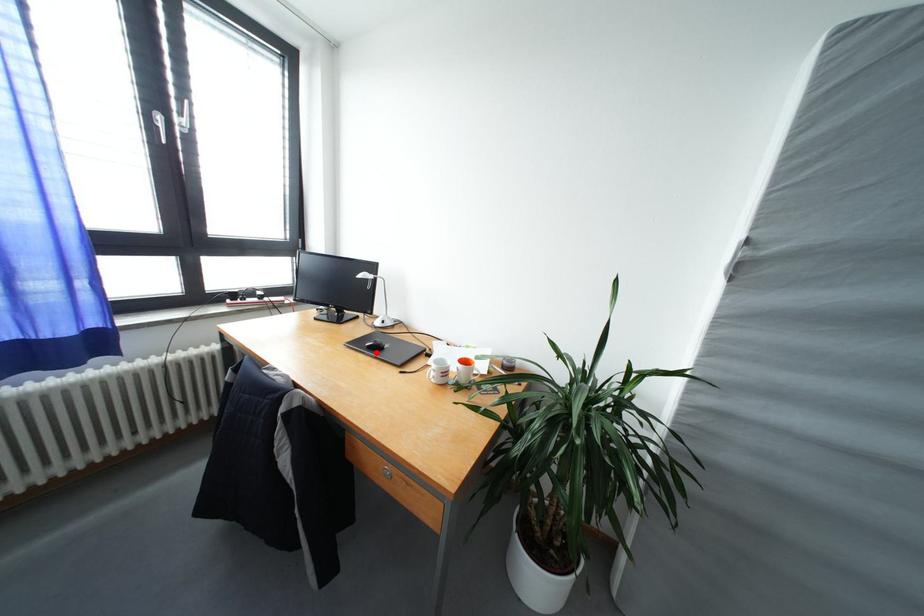
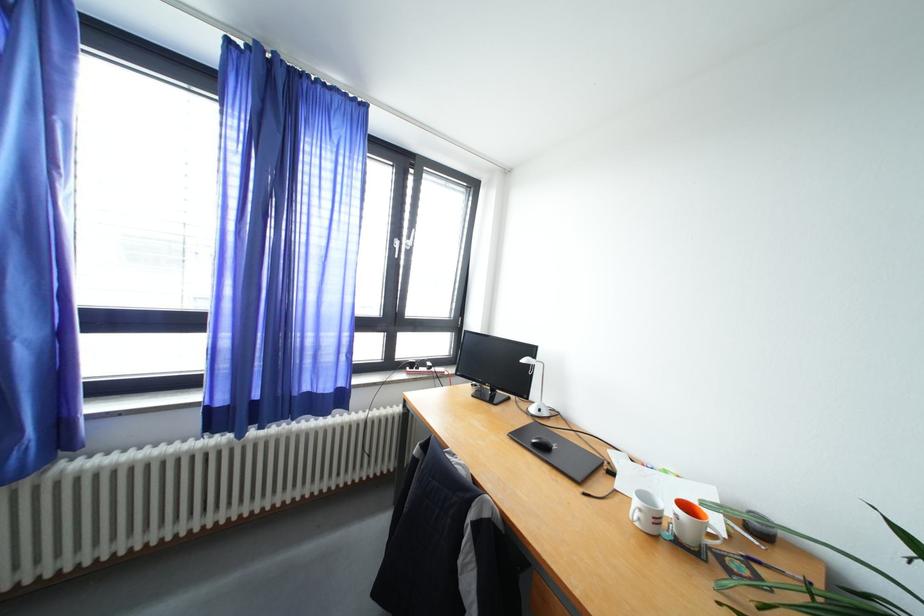
Locate, in the second image, the point that corresponds to the highlighted location in the first image.

(541, 450)